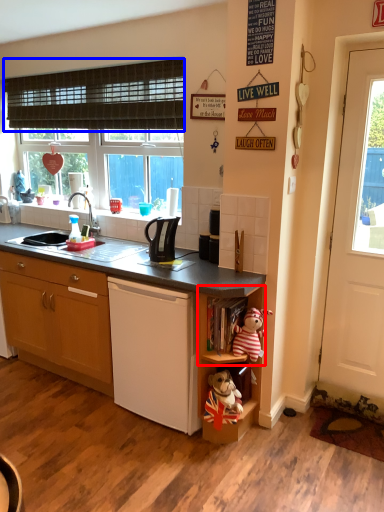
Question: Which of the following is the farthest to the observer, shelf (highlighted by a red box) or curtain (highlighted by a blue box)?

Choices:
 (A) shelf
 (B) curtain

Answer: (B)